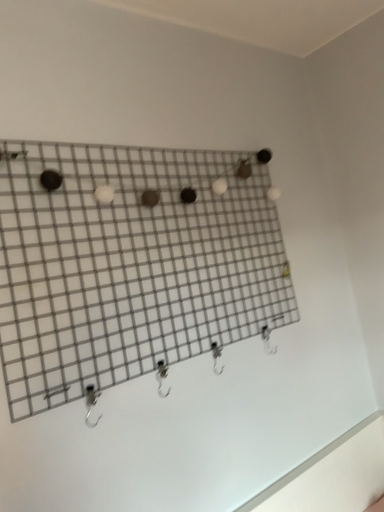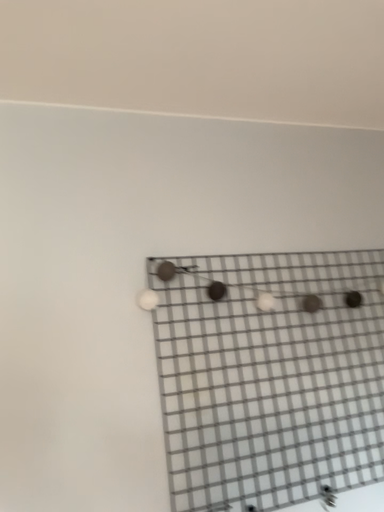
Question: Which way did the camera rotate in the video?

Choices:
 (A) rotated downward
 (B) rotated upward

Answer: (B)